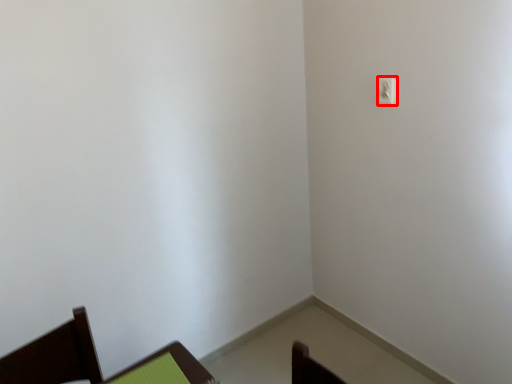
Question: From the image's perspective, considering the relative positions of light switch (annotated by the red box) and furniture in the image provided, where is light switch (annotated by the red box) located with respect to the staircase?

Choices:
 (A) above
 (B) below

Answer: (A)